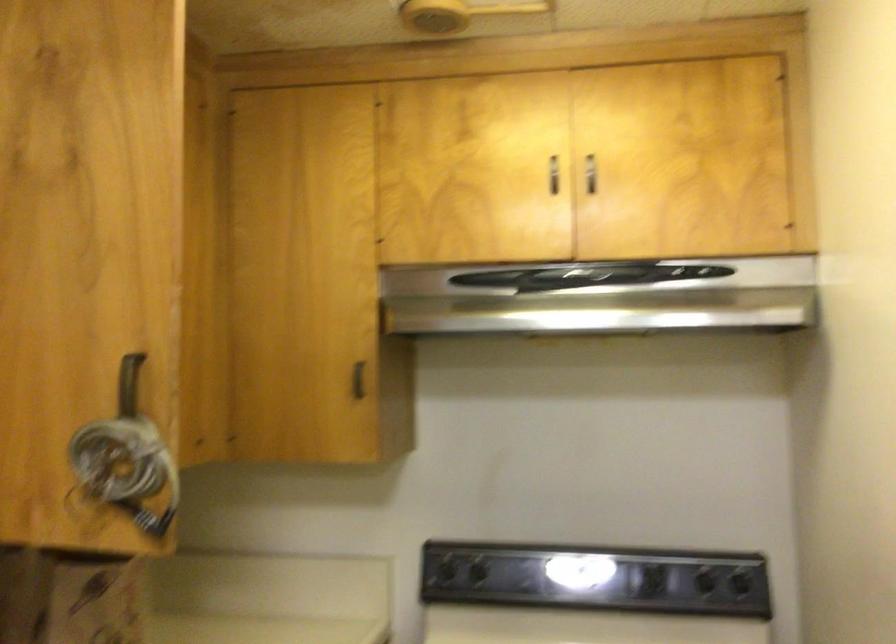
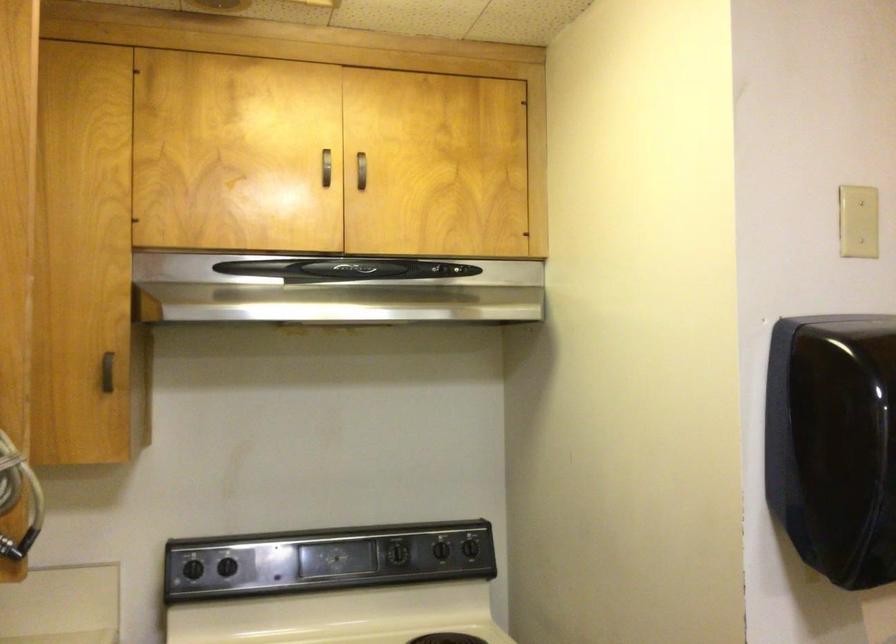
Locate, in the second image, the point that corresponds to the point at 593,169 in the first image.

(362, 169)